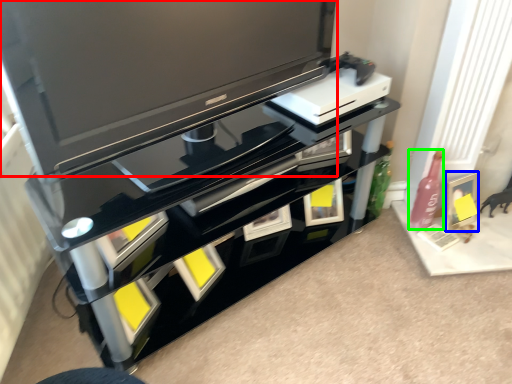
Question: Considering the real-world distances, which object is closest to television (highlighted by a red box)? picture frame (highlighted by a blue box) or bottle (highlighted by a green box).

Choices:
 (A) picture frame
 (B) bottle

Answer: (B)